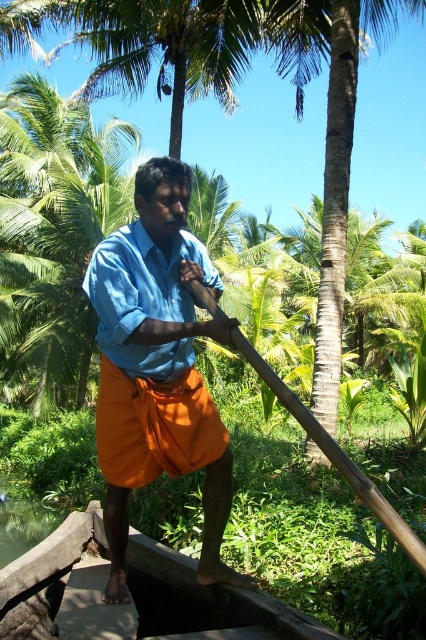
Question: Does blue cotton shirt at center have a lesser width compared to smooth brown trunk of palm tree at center?

Choices:
 (A) no
 (B) yes

Answer: (B)

Question: Estimate the real-world distances between objects in this image. Which object is closer to the smooth brown trunk of palm tree at center?

Choices:
 (A) brown wooden paddle at center
 (B) blue cotton shirt at center

Answer: (B)

Question: Can you confirm if smooth brown trunk of palm tree at center is bigger than brown wooden paddle at center?

Choices:
 (A) no
 (B) yes

Answer: (B)

Question: Which of these objects is positioned farthest from the brown wooden paddle at center?

Choices:
 (A) blue cotton shirt at center
 (B) smooth brown trunk of palm tree at center

Answer: (B)

Question: Which object appears farthest from the camera in this image?

Choices:
 (A) smooth brown trunk of palm tree at center
 (B) brown wooden paddle at center

Answer: (A)

Question: Does smooth brown trunk of palm tree at center appear over brown wooden paddle at center?

Choices:
 (A) yes
 (B) no

Answer: (A)